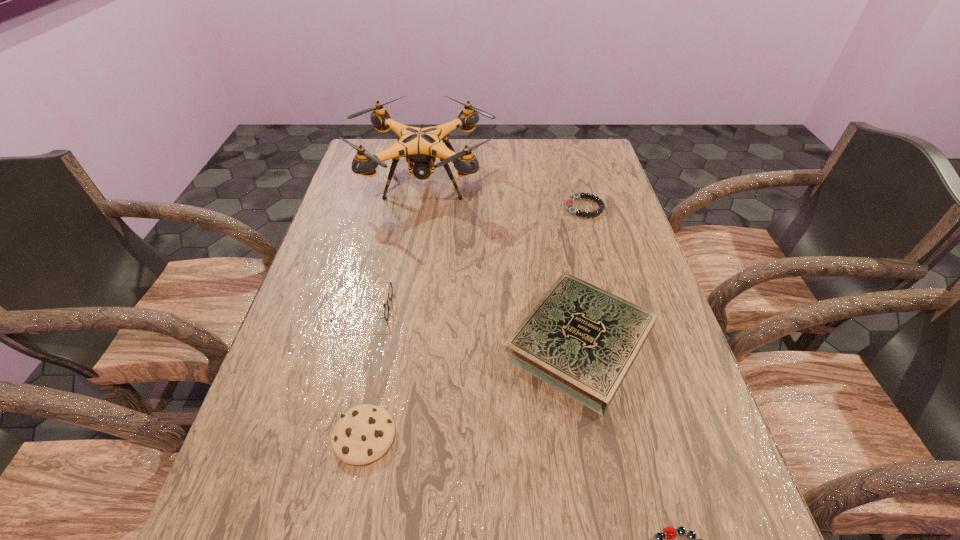
I want to click on object that is the fifth nearest to the sunglasses, so click(x=670, y=532).

Identify the location of object that stands as the third closest to the cookie. (670, 532).

This screenshot has width=960, height=540. I want to click on blank area in the image that satisfies the following two spatial constraints: 1. on the back side of the hardback book; 2. on the right side of the farther bracelet, so click(x=553, y=207).

At what (x,y) coordinates should I click in order to perform the action: click on free space that satisfies the following two spatial constraints: 1. on the camera mount of the tallest object; 2. on the front-facing side of the sunglasses. Please return your answer as a coordinate pair (x, y). Image resolution: width=960 pixels, height=540 pixels. Looking at the image, I should click on (405, 307).

Locate an element on the screen. Image resolution: width=960 pixels, height=540 pixels. free space that satisfies the following two spatial constraints: 1. on the camera mount of the second tallest object; 2. on the right side of the drone is located at coordinates (399, 342).

The image size is (960, 540). Find the location of `vacant region that satisfies the following two spatial constraints: 1. on the back side of the cookie; 2. on the right side of the taller bracelet`. vacant region that satisfies the following two spatial constraints: 1. on the back side of the cookie; 2. on the right side of the taller bracelet is located at coordinates (409, 207).

Locate an element on the screen. The height and width of the screenshot is (540, 960). vacant space that satisfies the following two spatial constraints: 1. on the camera mount of the hardback book; 2. on the right side of the drone is located at coordinates (399, 342).